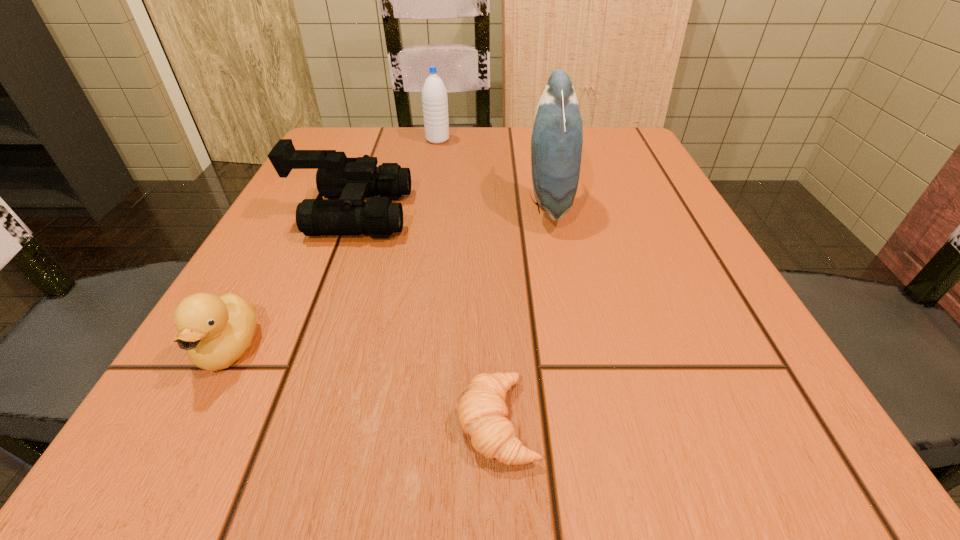
Find the location of a particular element. The image size is (960, 540). vacant space that satisfies the following two spatial constraints: 1. on the front lenses of the binoculars; 2. on the right side of the shortest object is located at coordinates (271, 422).

Locate an element on the screen. free location that satisfies the following two spatial constraints: 1. on the front lenses of the third shortest object; 2. on the left side of the crescent roll is located at coordinates (271, 422).